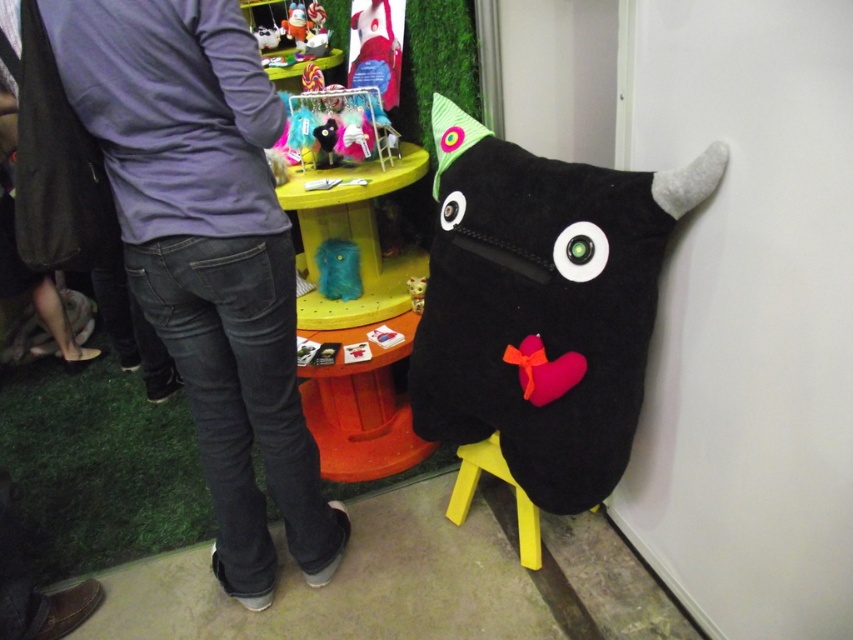
Question: Does dark denim jeans at lower left appear on the left side of teal felt pouch at center?

Choices:
 (A) no
 (B) yes

Answer: (B)

Question: Which point is closer to the camera?

Choices:
 (A) soft plush cat at center
 (B) teal felt pouch at center

Answer: (A)

Question: Can you confirm if soft plush toy at right is smaller than teal felt pouch at center?

Choices:
 (A) yes
 (B) no

Answer: (B)

Question: Which object is closer to the camera taking this photo?

Choices:
 (A) soft plush cat at center
 (B) dark denim jeans at lower left
 (C) teal felt pouch at center
 (D) soft plush toy at right

Answer: (D)

Question: Which is nearer to the dark denim jeans at lower left?

Choices:
 (A) fuzzy yellow plush at center
 (B) soft plush toy at right
 (C) yellow plastic stool at lower center

Answer: (B)

Question: Does dark denim jeans at lower left have a larger size compared to fuzzy yellow plush at center?

Choices:
 (A) yes
 (B) no

Answer: (A)